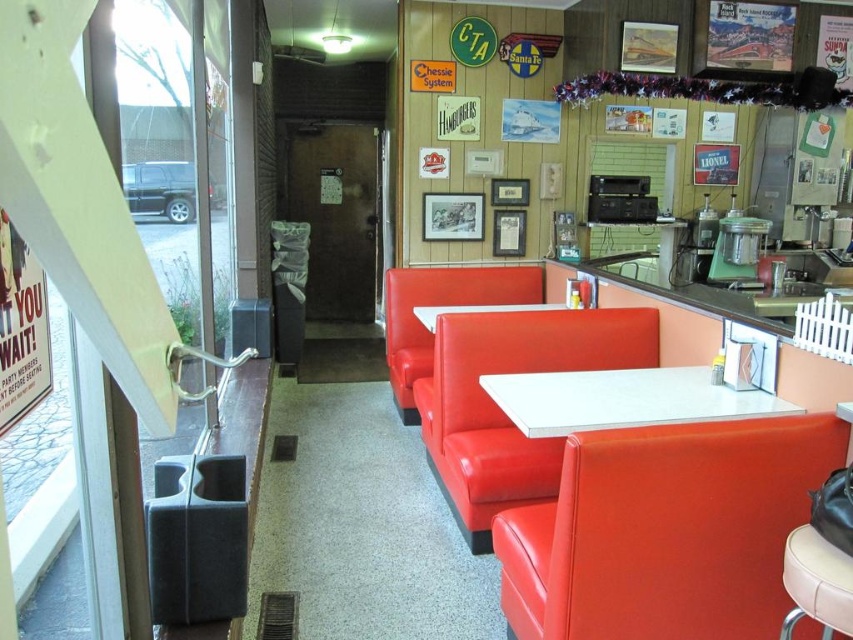
Does point (479, 433) come behind point (386, 328)?

No, (479, 433) is closer to viewer.

Does matte red booth at center have a larger size compared to matte vinyl booth at center?

Yes.

Is point (563, 336) less distant than point (389, 346)?

Yes.

Identify the location of matte red booth at center. The image size is (853, 640). (502, 410).

The height and width of the screenshot is (640, 853). What do you see at coordinates (440, 305) in the screenshot?
I see `matte vinyl booth at center` at bounding box center [440, 305].

Does point (535, 291) come farther from viewer compared to point (432, 307)?

Yes, point (535, 291) is behind point (432, 307).

The image size is (853, 640). I want to click on matte vinyl booth at center, so click(440, 305).

The image size is (853, 640). Describe the element at coordinates (502, 410) in the screenshot. I see `matte red booth at center` at that location.

Identify the location of matte red booth at center. This screenshot has width=853, height=640. (502, 410).